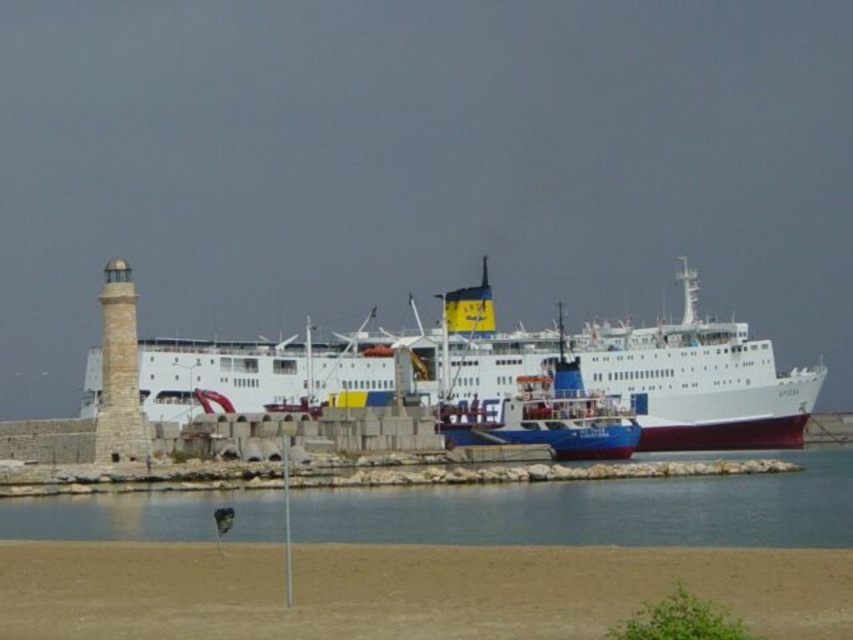
You are a marine biologist who needs to collect water samples from the clear water at lower center. Your boat can only approach within 30 meters of the white matte ship at center. Can you safely collect the samples without getting too close to the ship?

The distance between the white matte ship at center and the clear water at lower center is 30.76 meters. Since your boat can approach within 30 meters, you cannot safely collect the samples without getting too close to the ship.

You are standing on the beach and want to board the ferry. Which object is closer to you, the clear water at lower center or the blue glossy ferry at center?

The clear water at lower center is closer to you because it is not as tall as the blue glossy ferry at center, meaning the ferry is further away.

You are a passenger on the ferry and want to board the ship. Which one is closer to the dock? The white matte ship at center or the blue glossy ferry at center?

The white matte ship at center is closer to the dock because the blue glossy ferry at center is behind it.